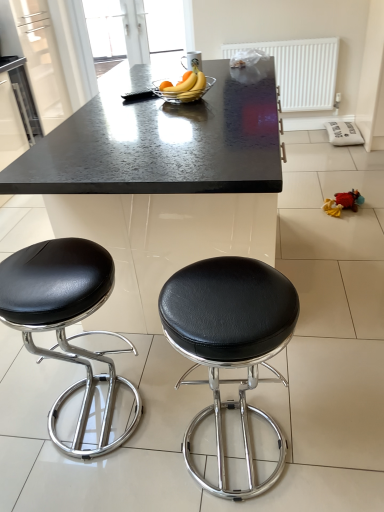
Question: Is black granite table at center at the left side of black leather stool at left, the 2th stool positioned from the right?

Choices:
 (A) no
 (B) yes

Answer: (A)

Question: Is black granite table at center facing towards black leather stool at left, the 2th stool positioned from the right?

Choices:
 (A) yes
 (B) no

Answer: (A)

Question: Can you confirm if black granite table at center is wider than black leather stool at left, the 2th stool positioned from the right?

Choices:
 (A) no
 (B) yes

Answer: (B)

Question: From the image's perspective, is black granite table at center located above black leather stool at left, which is the first stool from left to right?

Choices:
 (A) no
 (B) yes

Answer: (B)

Question: Is black granite table at center next to black leather stool at left, which is the first stool from left to right, and touching it?

Choices:
 (A) no
 (B) yes

Answer: (A)

Question: Is black leather stool at left, which is the first stool from left to right, situated inside clear glass bowl at center or outside?

Choices:
 (A) outside
 (B) inside

Answer: (A)

Question: Considering the positions of point (137, 395) and point (198, 96), is point (137, 395) closer or farther from the camera than point (198, 96)?

Choices:
 (A) farther
 (B) closer

Answer: (B)

Question: In the image, is black leather stool at left, which is the first stool from left to right, positioned in front of or behind clear glass bowl at center?

Choices:
 (A) behind
 (B) front

Answer: (B)

Question: Is black leather stool at left, which is the first stool from left to right, to the left or to the right of clear glass bowl at center in the image?

Choices:
 (A) left
 (B) right

Answer: (A)

Question: Would you say white textured radiator at upper center is to the left or to the right of yellow matte banana at center in the picture?

Choices:
 (A) left
 (B) right

Answer: (B)

Question: Considering their positions, is white textured radiator at upper center located in front of or behind yellow matte banana at center?

Choices:
 (A) front
 (B) behind

Answer: (B)

Question: Considering the positions of white textured radiator at upper center and yellow matte banana at center in the image, is white textured radiator at upper center taller or shorter than yellow matte banana at center?

Choices:
 (A) short
 (B) tall

Answer: (B)

Question: From the image's perspective, relative to yellow matte banana at center, is white textured radiator at upper center above or below?

Choices:
 (A) below
 (B) above

Answer: (B)

Question: From a real-world perspective, is black leather stool at left, which is the first stool from left to right, positioned above or below white textured radiator at upper center?

Choices:
 (A) above
 (B) below

Answer: (B)

Question: Considering the positions of point (56, 256) and point (296, 46), is point (56, 256) closer or farther from the camera than point (296, 46)?

Choices:
 (A) farther
 (B) closer

Answer: (B)